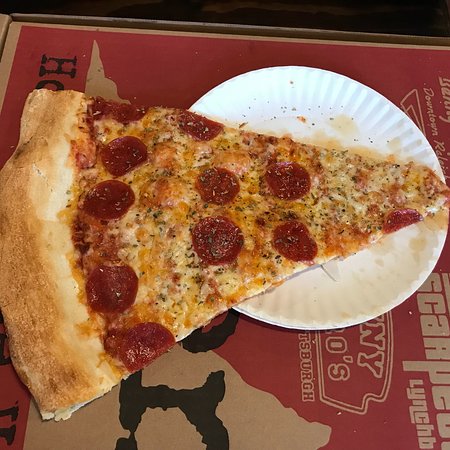
Image resolution: width=450 pixels, height=450 pixels. What are the coordinates of `plate` in the screenshot? It's located at (348, 279).